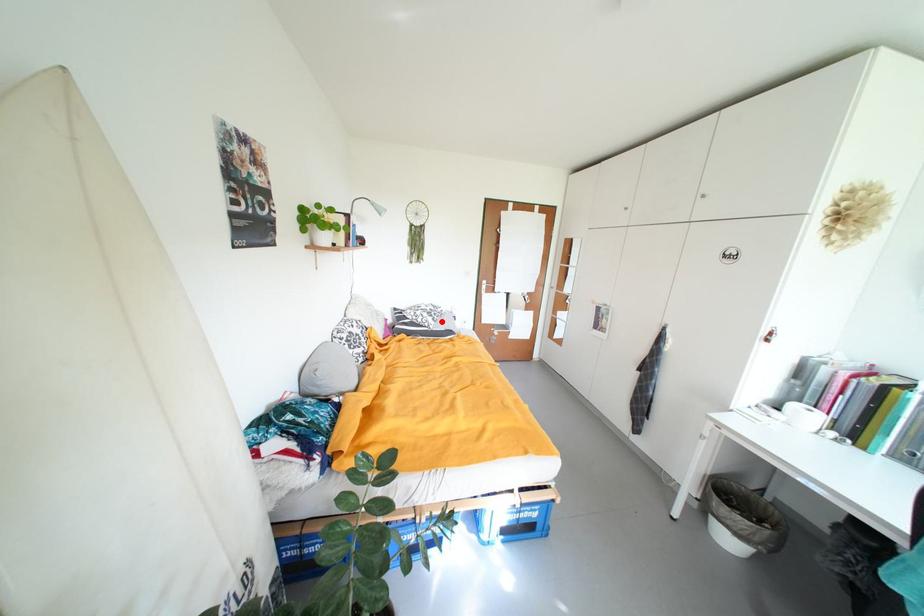
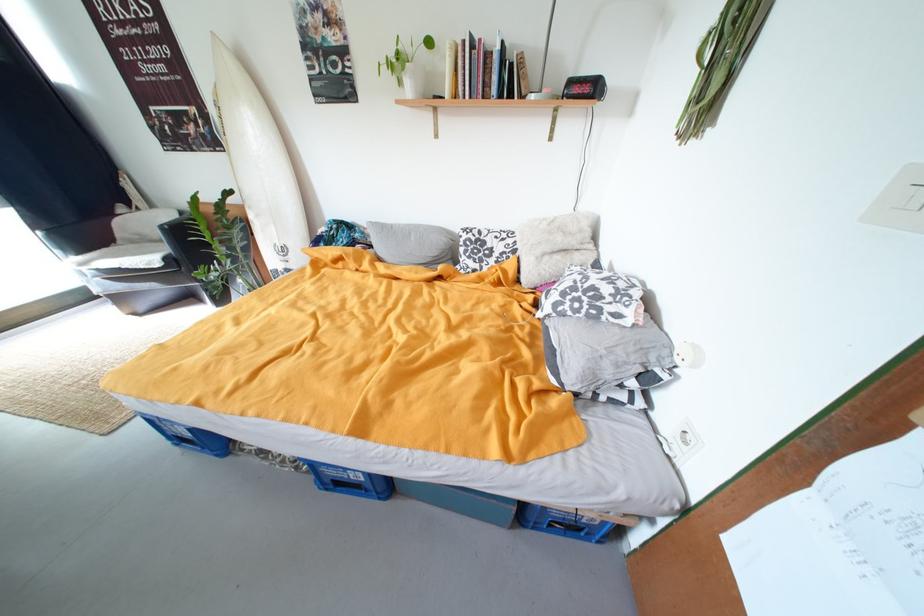
Where in the second image is the point corresponding to the highlighted location from the first image?

(564, 306)